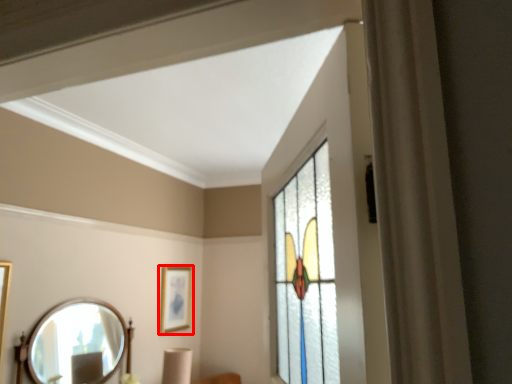
Question: From the image, what is the correct spatial relationship of picture frame (annotated by the red box) in relation to mirror?

Choices:
 (A) right
 (B) left

Answer: (A)